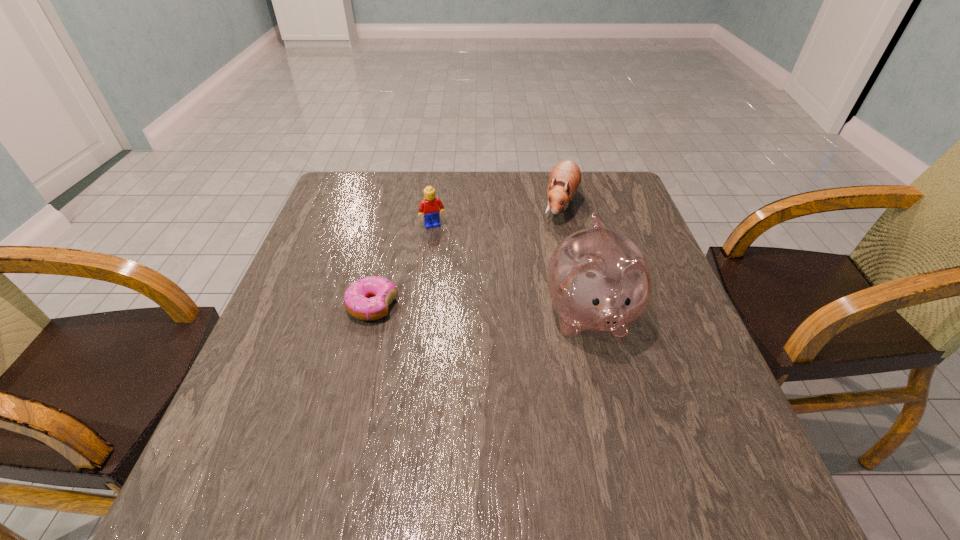
Image resolution: width=960 pixels, height=540 pixels. I want to click on doughnut, so click(368, 298).

Locate an element on the screen. the leftmost object is located at coordinates (368, 298).

Where is `piggy bank`? piggy bank is located at coordinates (598, 279).

You are a GUI agent. You are given a task and a screenshot of the screen. Output one action in this format:
    pyautogui.click(x=<x>, y=<y>)
    Task: Click on the hamster
    This screenshot has height=540, width=960.
    Given the screenshot: What is the action you would take?
    pyautogui.click(x=565, y=178)

You are a GUI agent. You are given a task and a screenshot of the screen. Output one action in this format:
    pyautogui.click(x=<x>, y=<y>)
    Task: Click on the Lego
    The image size is (960, 540).
    Given the screenshot: What is the action you would take?
    pyautogui.click(x=428, y=207)

The height and width of the screenshot is (540, 960). Find the location of `free spot located 0.170m on the right of the leftmost object`. free spot located 0.170m on the right of the leftmost object is located at coordinates (474, 306).

Where is `vacant space located on the front facing side of the tallest object`? Image resolution: width=960 pixels, height=540 pixels. vacant space located on the front facing side of the tallest object is located at coordinates (615, 420).

Where is `vacant space located 0.050m at the face of the hamster`? This screenshot has height=540, width=960. vacant space located 0.050m at the face of the hamster is located at coordinates (550, 235).

Locate an element on the screen. The image size is (960, 540). vacant area situated 0.240m at the face of the hamster is located at coordinates (524, 278).

Image resolution: width=960 pixels, height=540 pixels. Find the location of `vacant position located at the face of the hamster`. vacant position located at the face of the hamster is located at coordinates (549, 237).